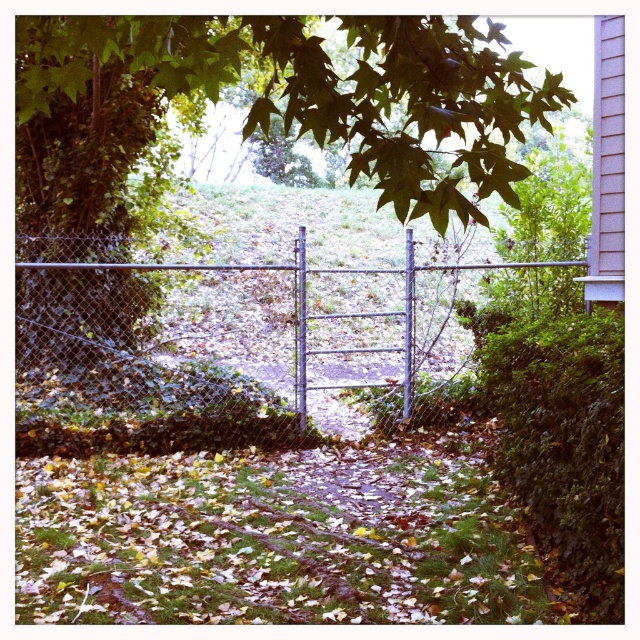
You are standing in front of the gate and want to walk to the green leafy hedge at right. Which direction should you go relative to the green leafy tree at center?

You should go to the right of the green leafy tree at center to reach the green leafy hedge at right since the green leafy hedge at right is located to the right side of the green leafy tree at center.